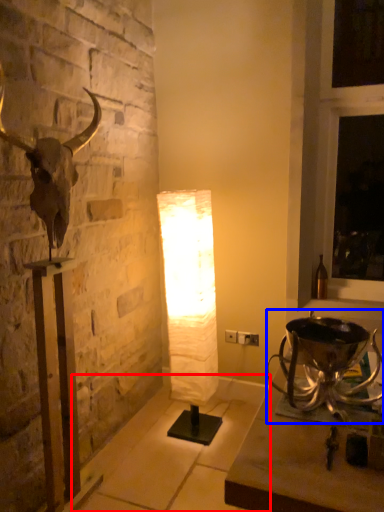
Question: Which object is further to the camera taking this photo, concrete (highlighted by a red box) or candle holder (highlighted by a blue box)?

Choices:
 (A) concrete
 (B) candle holder

Answer: (A)